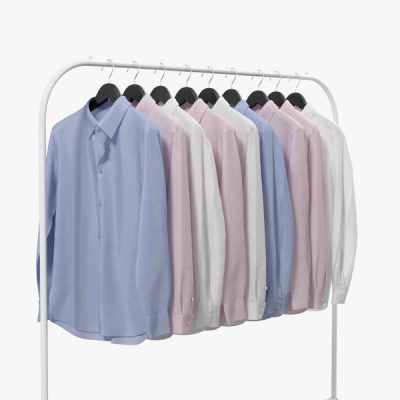
You are a GUI agent. You are given a task and a screenshot of the screen. Output one action in this format:
    pyautogui.click(x=<x>, y=<y>)
    Task: Click on the coat hangers
    
    Given the screenshot: What is the action you would take?
    pyautogui.click(x=106, y=87), pyautogui.click(x=134, y=92), pyautogui.click(x=160, y=91), pyautogui.click(x=187, y=89), pyautogui.click(x=210, y=92), pyautogui.click(x=232, y=93), pyautogui.click(x=257, y=92), pyautogui.click(x=276, y=96), pyautogui.click(x=298, y=96)